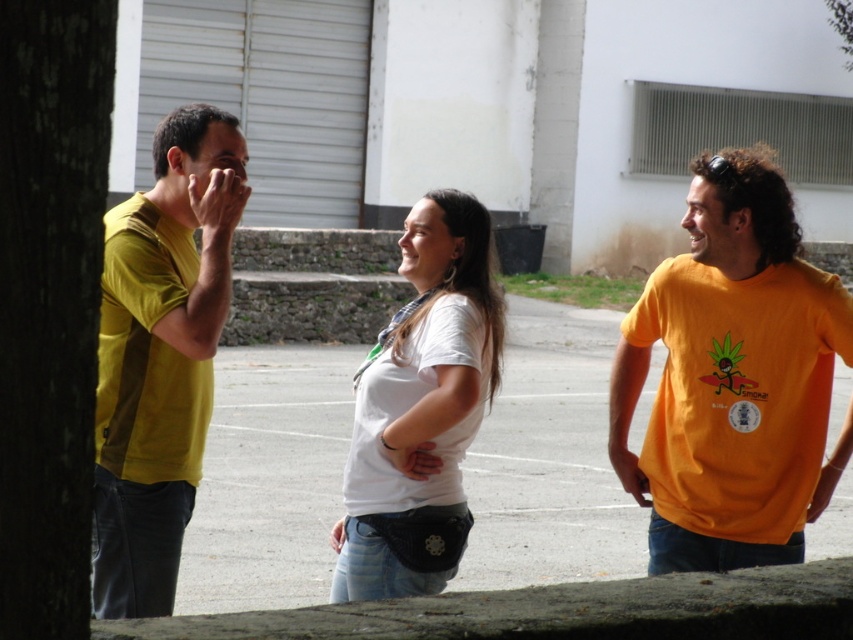
Is point (654, 273) farther from camera compared to point (115, 404)?

Yes.

Can you confirm if orange matte t-shirt at right is smaller than yellow matte shirt at left?

Indeed, orange matte t-shirt at right has a smaller size compared to yellow matte shirt at left.

Between point (734, 337) and point (149, 524), which one is positioned behind?

The point (734, 337) is more distant.

I want to click on orange matte t-shirt at right, so click(733, 378).

This screenshot has height=640, width=853. What do you see at coordinates (733, 378) in the screenshot?
I see `orange matte t-shirt at right` at bounding box center [733, 378].

At what (x,y) coordinates should I click in order to perform the action: click on orange matte t-shirt at right. Please return your answer as a coordinate pair (x, y). Looking at the image, I should click on (733, 378).

What are the coordinates of `orange matte t-shirt at right` in the screenshot? It's located at (733, 378).

This screenshot has width=853, height=640. I want to click on orange matte t-shirt at right, so click(x=733, y=378).

Who is lower down, yellow matte shirt at left or white matte shirt at center?

white matte shirt at center

Is yellow matte shirt at left thinner than white matte shirt at center?

Yes, yellow matte shirt at left is thinner than white matte shirt at center.

Does point (157, 355) lie behind point (409, 509)?

Yes, it is.

Identify the location of yellow matte shirt at left. This screenshot has height=640, width=853. (160, 355).